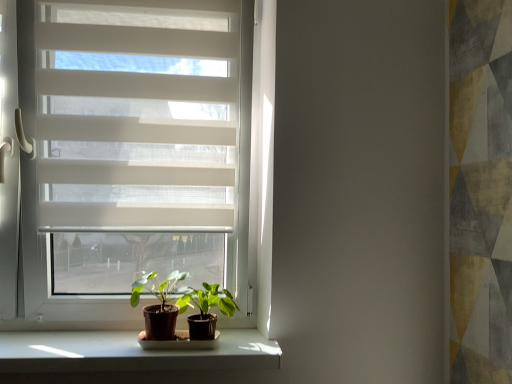
Locate an element on the screen. The height and width of the screenshot is (384, 512). vacant space that is in between green matte plant at center, arranged as the second houseplant when viewed from the right, and white matte window at center is located at coordinates (81, 349).